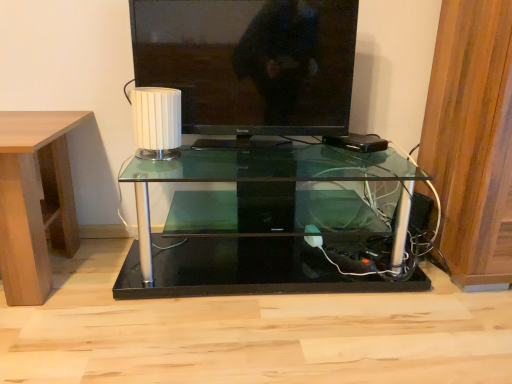
What is the approximate height of transparent glass table at center?

The height of transparent glass table at center is 15.53 inches.

Identify the location of light brown wood at left. (35, 200).

In order to face white ribbed lampshade at center, should I rotate leftwards or rightwards?

You should rotate left by 12.857 degrees.

I want to click on transparent glass table at center, so click(x=275, y=224).

Considering the relative positions of transparent glass table at center and light brown wood at left in the image provided, is transparent glass table at center to the right of light brown wood at left from the viewer's perspective?

Indeed, transparent glass table at center is positioned on the right side of light brown wood at left.

From a real-world perspective, is transparent glass table at center physically below light brown wood at left?

Indeed, from a real-world perspective, transparent glass table at center is positioned beneath light brown wood at left.

How many degrees apart are the facing directions of transparent glass table at center and light brown wood at left?

The angular difference between transparent glass table at center and light brown wood at left is 0.31 degrees.

From their relative heights in the image, would you say transparent glass table at center is taller or shorter than light brown wood at left?

Clearly, transparent glass table at center is shorter compared to light brown wood at left.

Measure the distance between matte black television at upper center and light brown wood at left.

The distance of matte black television at upper center from light brown wood at left is 22.28 inches.

Consider the image. From the image's perspective, is matte black television at upper center above light brown wood at left?

Indeed, from the image's perspective, matte black television at upper center is shown above light brown wood at left.

From a real-world perspective, is matte black television at upper center on light brown wood at left?

Indeed, from a real-world perspective, matte black television at upper center stands above light brown wood at left.

Is matte black television at upper center next to light brown wood at left?

No, matte black television at upper center is not touching light brown wood at left.

Is white ribbed lampshade at center at the left side of transparent glass table at center?

Yes, white ribbed lampshade at center is to the left of transparent glass table at center.

From the image's perspective, is white ribbed lampshade at center above or below transparent glass table at center?

white ribbed lampshade at center is above transparent glass table at center.

Is white ribbed lampshade at center located outside transparent glass table at center?

white ribbed lampshade at center is positioned outside transparent glass table at center.

Considering the relative positions of white ribbed lampshade at center and transparent glass table at center in the image provided, is white ribbed lampshade at center in front of transparent glass table at center?

No, white ribbed lampshade at center is further to the viewer.

From the image's perspective, between light brown wood at left and transparent glass table at center, which one is located above?

light brown wood at left.

Based on the photo, what's the angular difference between light brown wood at left and transparent glass table at center's facing directions?

0.31 degrees separate the facing orientations of light brown wood at left and transparent glass table at center.

Based on their positions, is light brown wood at left located to the left or right of transparent glass table at center?

light brown wood at left is positioned on transparent glass table at center's left side.

This screenshot has height=384, width=512. I want to click on desk located on the left of transparent glass table at center, so click(x=35, y=200).

Which object is closer to the camera taking this photo, light brown wood at left or matte black television at upper center?

light brown wood at left is closer to the camera.

Consider the image. From the image's perspective, is light brown wood at left above matte black television at upper center?

No, from the image's perspective, light brown wood at left is not over matte black television at upper center.

Is there a large distance between light brown wood at left and matte black television at upper center?

Actually, light brown wood at left and matte black television at upper center are a little close together.

Is light brown wood at left facing towards matte black television at upper center?

No, light brown wood at left is not turned towards matte black television at upper center.

Considering the points (145, 109) and (298, 92), which point is in front, point (145, 109) or point (298, 92)?

Point (145, 109)

Who is shorter, white ribbed lampshade at center or matte black television at upper center?

With less height is white ribbed lampshade at center.

In the image, there is a matte black television at upper center. Identify the location of lamp below it (from the image's perspective). (157, 122).

Looking at this image, is white ribbed lampshade at center smaller than matte black television at upper center?

Yes, white ribbed lampshade at center is smaller than matte black television at upper center.

Is matte black television at upper center located within transparent glass table at center?

No, matte black television at upper center is not inside transparent glass table at center.

Can you see transparent glass table at center touching matte black television at upper center?

No, transparent glass table at center is not next to matte black television at upper center.

What's the angular difference between transparent glass table at center and matte black television at upper center's facing directions?

They differ by 9.82 degrees in their facing directions.

Which is in front, point (415, 266) or point (136, 53)?

The point (415, 266) is in front.

The image size is (512, 384). In order to click on desk that is in front of the transparent glass table at center in this screenshot , I will do [x=35, y=200].

At what (x,y) coordinates should I click in order to perform the action: click on desk that appears on the left of matte black television at upper center. Please return your answer as a coordinate pair (x, y). This screenshot has width=512, height=384. Looking at the image, I should click on (35, 200).

From the image, which object appears to be farther from white ribbed lampshade at center, transparent glass table at center or matte black television at upper center?

transparent glass table at center is positioned further to the anchor white ribbed lampshade at center.

From the image, which object appears to be farther from light brown wood at left, white ribbed lampshade at center or transparent glass table at center?

The object further to light brown wood at left is transparent glass table at center.

Estimate the real-world distances between objects in this image. Which object is closer to matte black television at upper center, light brown wood at left or transparent glass table at center?

Based on the image, transparent glass table at center appears to be nearer to matte black television at upper center.

Looking at the image, which one is located closer to matte black television at upper center, transparent glass table at center or light brown wood at left?

Based on the image, transparent glass table at center appears to be nearer to matte black television at upper center.

When comparing their distances from light brown wood at left, does transparent glass table at center or matte black television at upper center seem closer?

Among the two, matte black television at upper center is located nearer to light brown wood at left.

Based on their spatial positions, is light brown wood at left or white ribbed lampshade at center closer to transparent glass table at center?

white ribbed lampshade at center.

Based on their spatial positions, is matte black television at upper center or white ribbed lampshade at center further from transparent glass table at center?

white ribbed lampshade at center is positioned further to the anchor transparent glass table at center.

When comparing their distances from transparent glass table at center, does white ribbed lampshade at center or light brown wood at left seem closer?

white ribbed lampshade at center is positioned closer to the anchor transparent glass table at center.

This screenshot has height=384, width=512. I want to click on lamp between light brown wood at left and matte black television at upper center from left to right, so click(x=157, y=122).

Locate an element on the screen. television between light brown wood at left and transparent glass table at center is located at coordinates (250, 63).

Identify the location of lamp between matte black television at upper center and transparent glass table at center in the up-down direction. This screenshot has width=512, height=384. (157, 122).

I want to click on lamp between light brown wood at left and transparent glass table at center, so point(157,122).